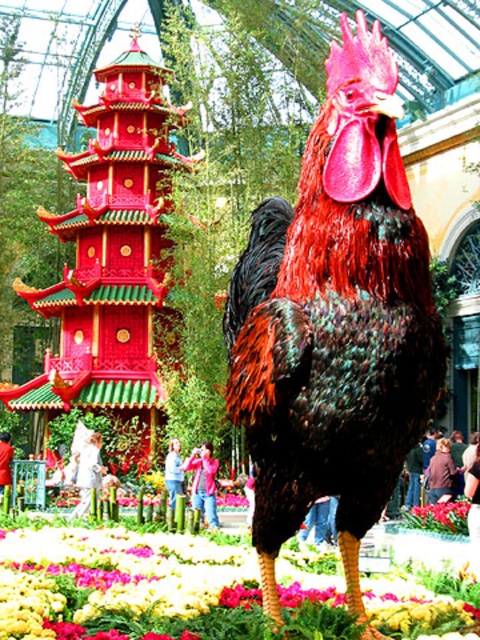
You are an artist planning to paint this scene. You have limited canvas space and want to focus on the shiny red and black feathers at center and the multicolored fabric at lower center. Which object should you prioritize to ensure it fits better on your canvas?

The multicolored fabric at lower center should be prioritized because it occupies more space than the shiny red and black feathers at center, making it easier to fit on the canvas.

You are a gardener who wants to place a new decorative pot between the shiny red and black feathers at center and the vivid pink petals at center. Based on their positions, which object should the pot be closer to if it needs to be placed exactly halfway between them?

The pot should be placed closer to the shiny red and black feathers at center because it is to the left of the vivid pink petals at center. Since the pot needs to be exactly halfway between them, it would be positioned midway between the two objects, maintaining equal distance from both.